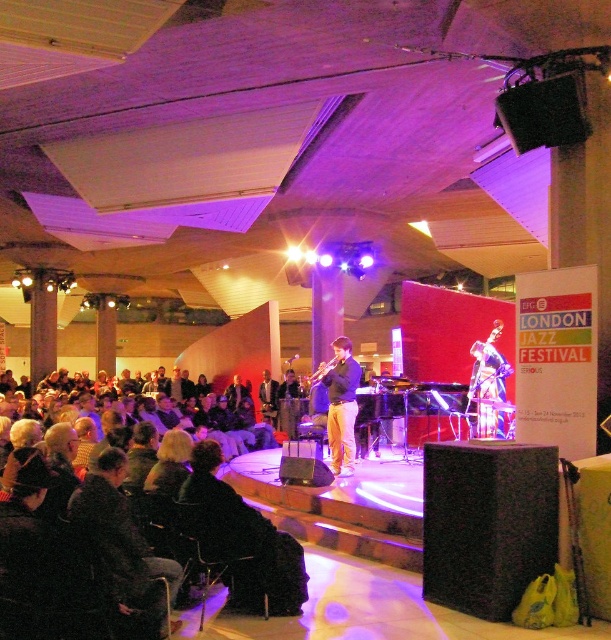
Is point (98, 545) farther from camera compared to point (273, 410)?

No.

Which is more to the left, dark brown leather jacket at lower left or dark brown leather jacket at center?

From the viewer's perspective, dark brown leather jacket at lower left appears more on the left side.

Does point (54, 509) come in front of point (273, 387)?

Yes, point (54, 509) is in front of point (273, 387).

The width and height of the screenshot is (611, 640). In order to click on dark brown leather jacket at lower left in this screenshot , I will do `click(75, 550)`.

Which is more to the right, black textured speaker at center or light brown leather pants at center?

black textured speaker at center is more to the right.

Is point (502, 484) positioned before point (342, 470)?

Yes, it is in front of point (342, 470).

Does point (513, 605) come behind point (338, 432)?

No, (513, 605) is closer to viewer.

You are a GUI agent. You are given a task and a screenshot of the screen. Output one action in this format:
    pyautogui.click(x=<x>, y=<y>)
    Task: Click on the black textured speaker at center
    The height and width of the screenshot is (640, 611).
    Given the screenshot: What is the action you would take?
    pyautogui.click(x=488, y=524)

Looking at this image, who is more forward, (499, 602) or (273, 420)?

Point (499, 602) is in front.

Can you confirm if black textured speaker at center is positioned to the right of dark brown leather jacket at center?

Yes, black textured speaker at center is to the right of dark brown leather jacket at center.

This screenshot has width=611, height=640. What are the coordinates of `black textured speaker at center` in the screenshot? It's located at (488, 524).

The image size is (611, 640). What are the coordinates of `black textured speaker at center` in the screenshot? It's located at (488, 524).